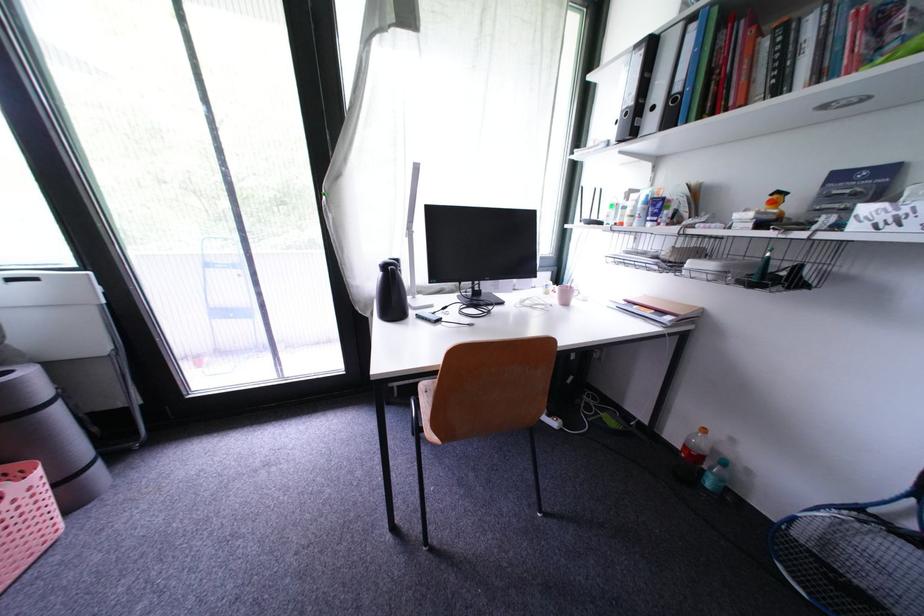
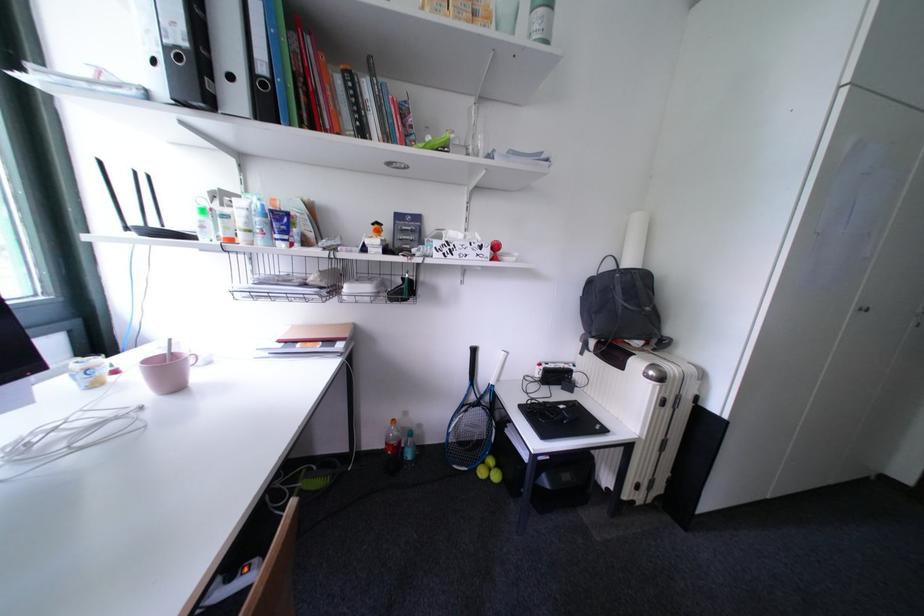
Question: The camera is either moving clockwise (left) or counter-clockwise (right) around the object. The first image is from the beginning of the video and the second image is from the end. Is the camera moving left or right when shooting the video?

Choices:
 (A) Left
 (B) Right

Answer: (A)